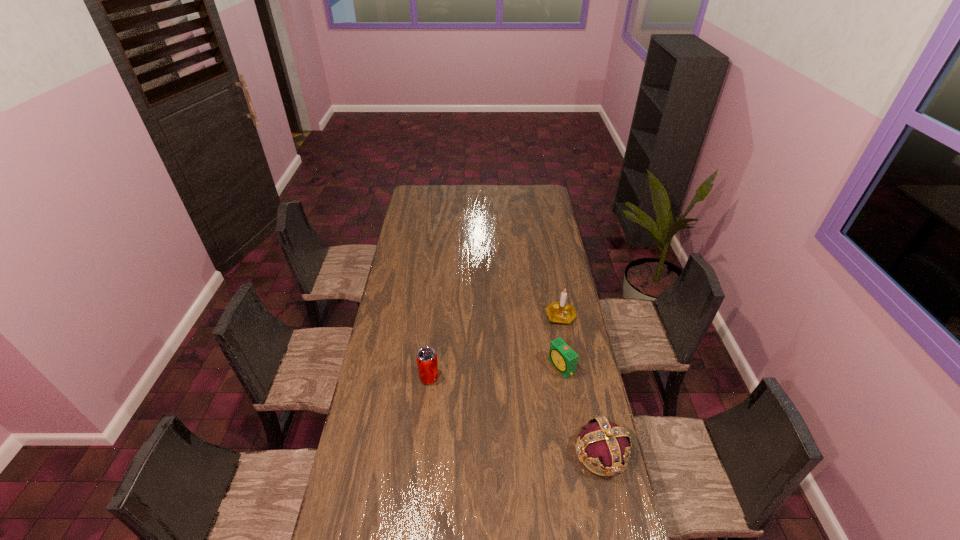
Find the location of a particular element. This screenshot has height=540, width=960. free space on the desktop that is between the soda can and the nearest object and is positioned on the front-facing side of the alarm clock is located at coordinates (492, 405).

The image size is (960, 540). What are the coordinates of `free space on the desktop that is between the soda can and the nearest object and is positioned with a handle on the candle holder` in the screenshot? It's located at (523, 418).